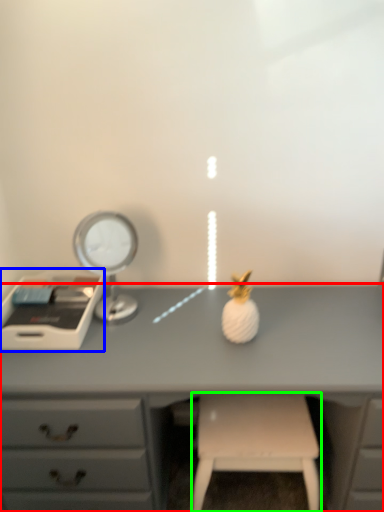
Question: Estimate the real-world distances between objects in this image. Which object is closer to desk (highlighted by a red box), writing desk (highlighted by a blue box) or stool (highlighted by a green box)?

Choices:
 (A) writing desk
 (B) stool

Answer: (B)